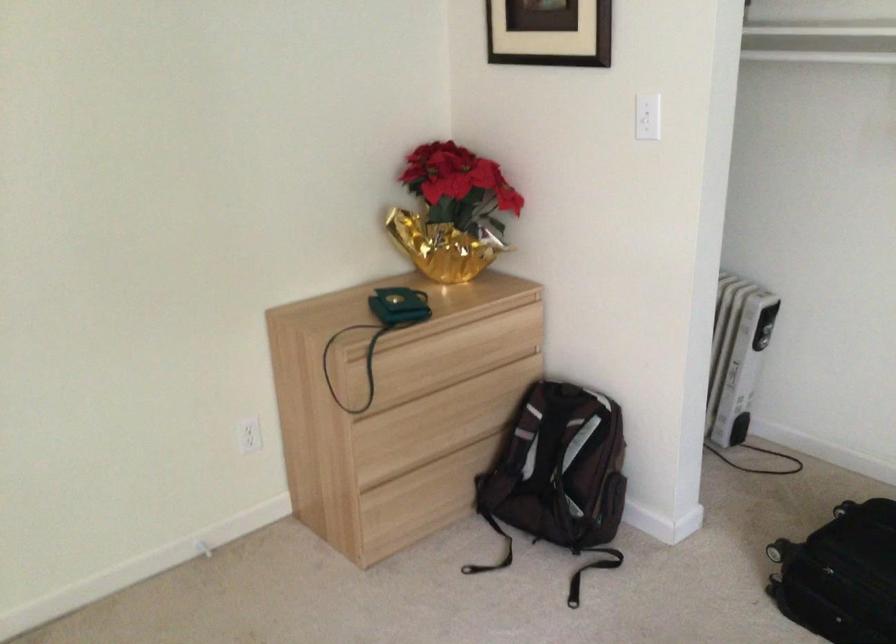
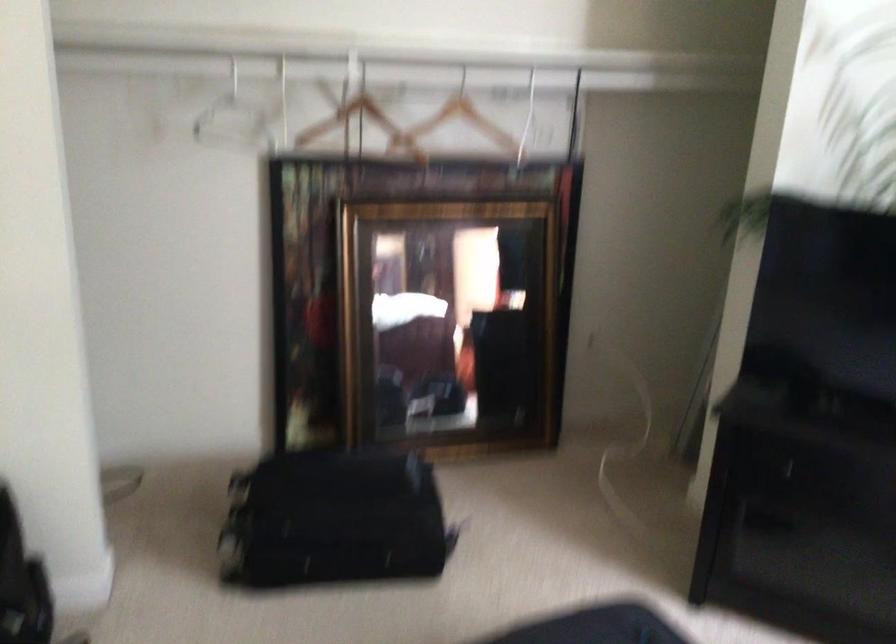
Question: How did the camera likely rotate?

Choices:
 (A) Left
 (B) Right
 (C) Up
 (D) Down

Answer: (B)